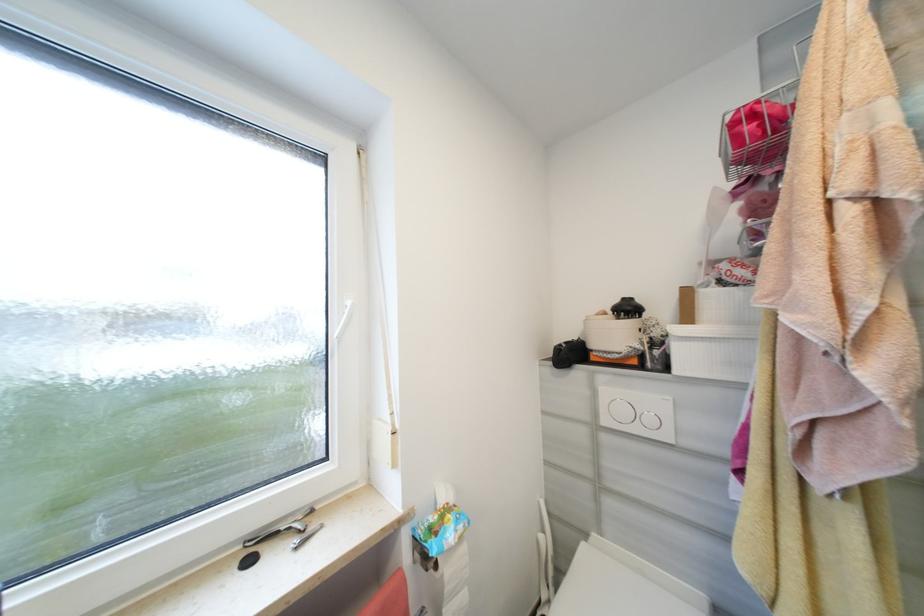
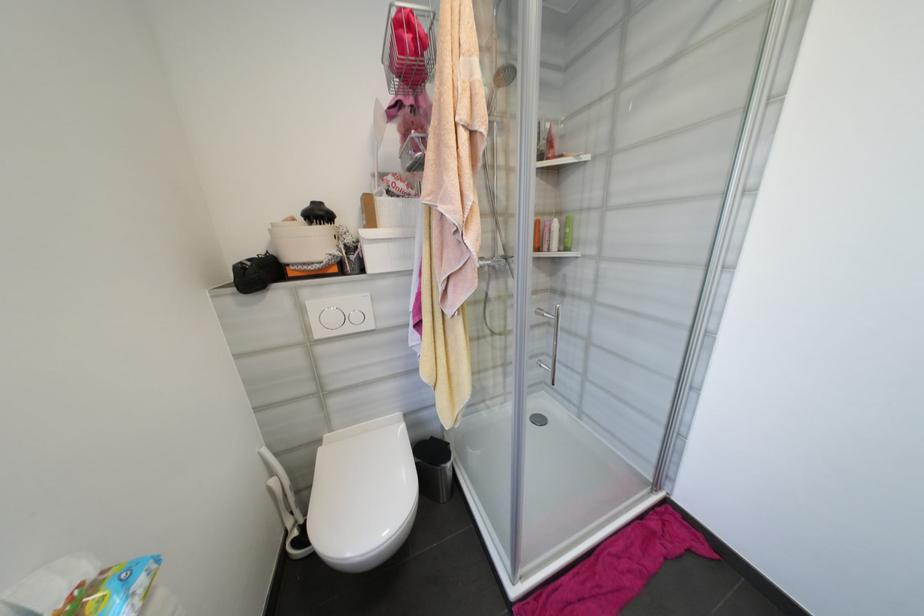
In the second image, find the point that corresponds to point (655, 421) in the first image.

(361, 318)